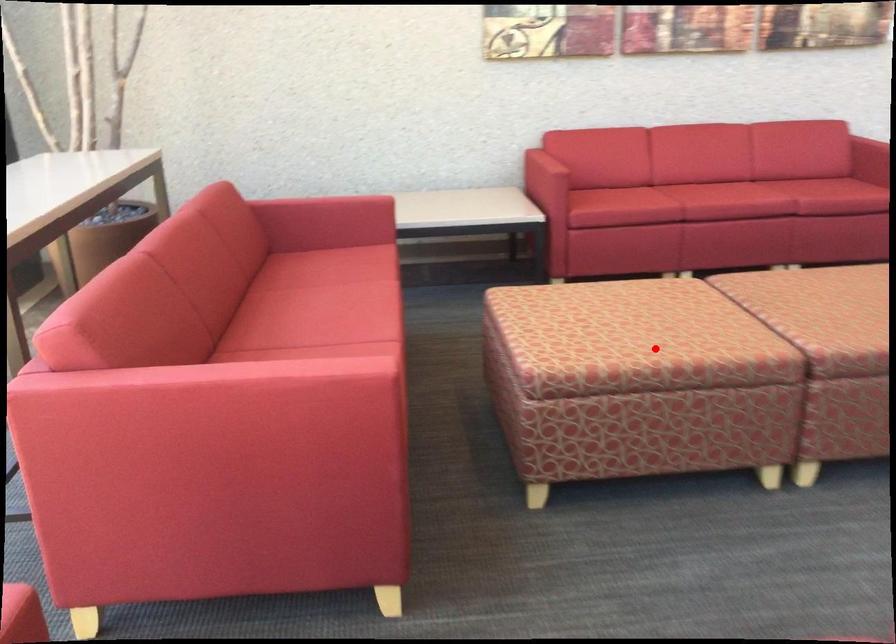
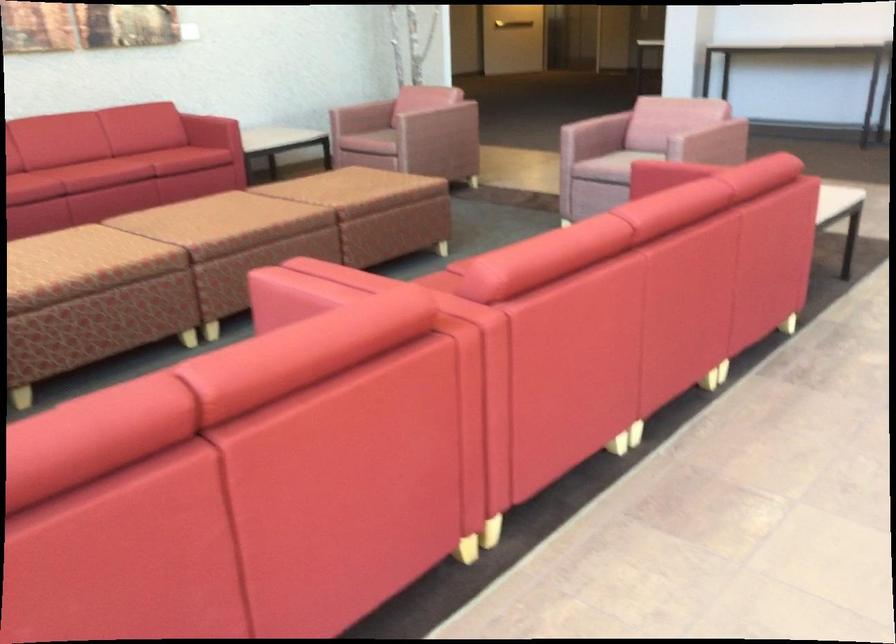
Question: A red point is marked in image1. In image2, is the corresponding 3D point closer to the camera or farther? Reply with the corresponding letter.

Choices:
 (A) The corresponding 3D point is closer.
 (B) The corresponding 3D point is farther.

Answer: (B)